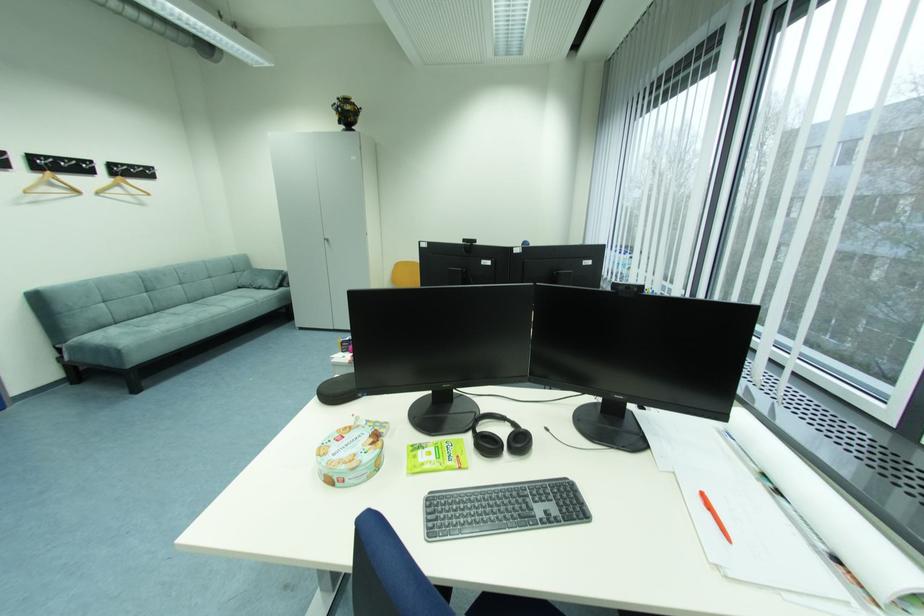
Where is `decorative vase`? This screenshot has height=616, width=924. decorative vase is located at coordinates (346, 111).